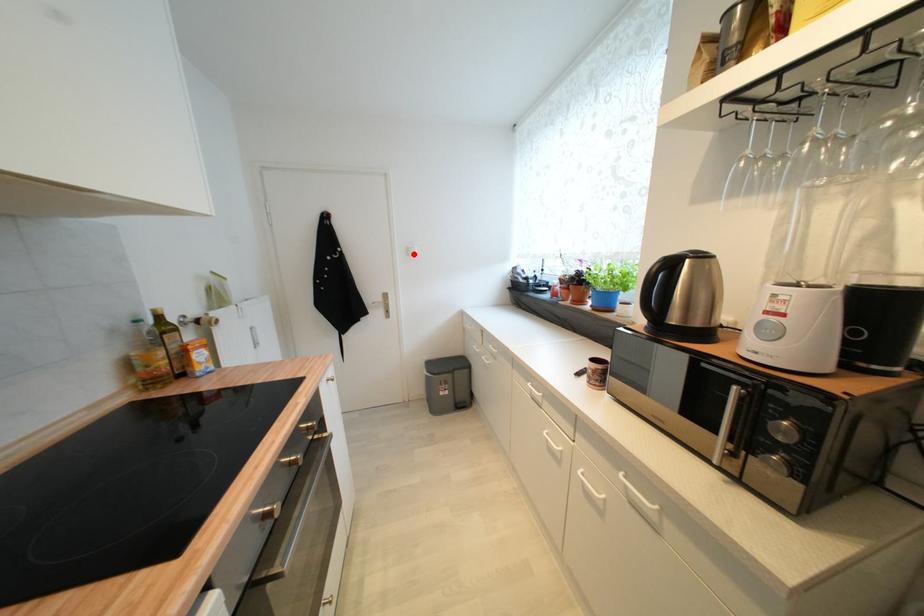
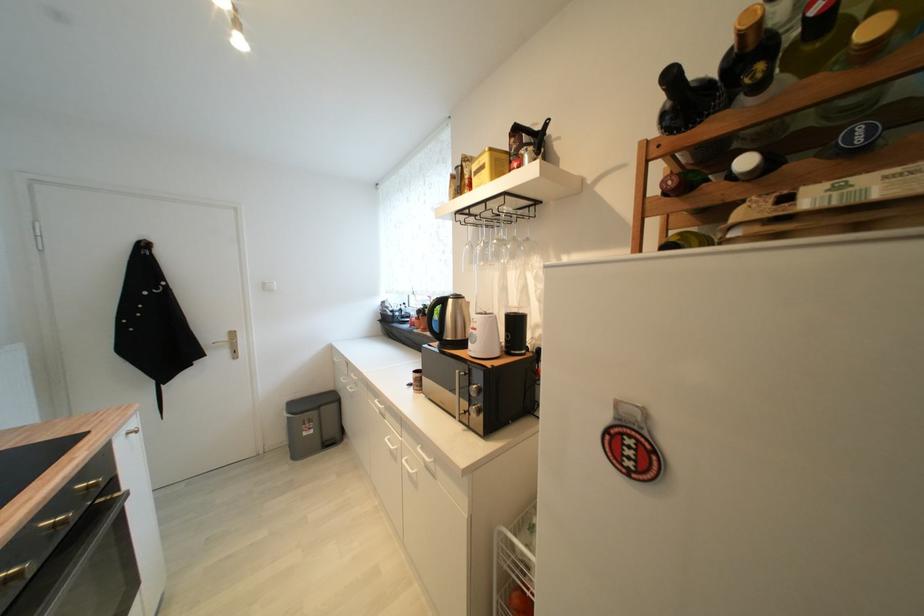
Locate, in the second image, the point that corresponds to the highlighted location in the first image.

(271, 289)